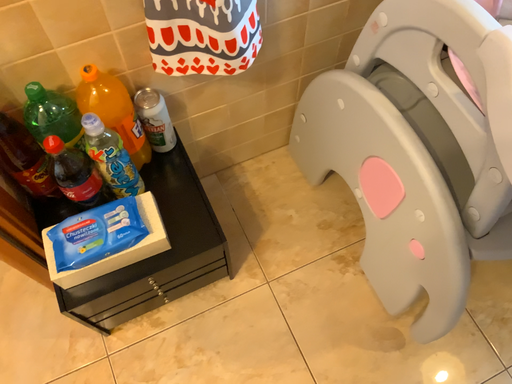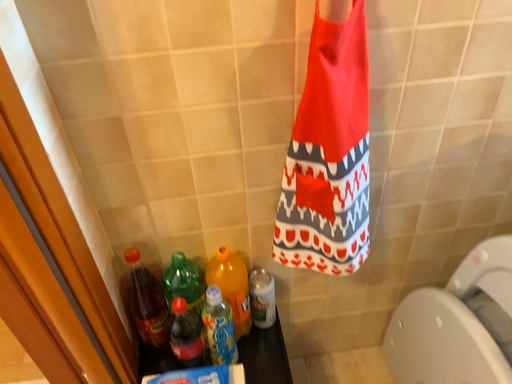
Question: Which way did the camera rotate in the video?

Choices:
 (A) rotated downward
 (B) rotated upward

Answer: (B)